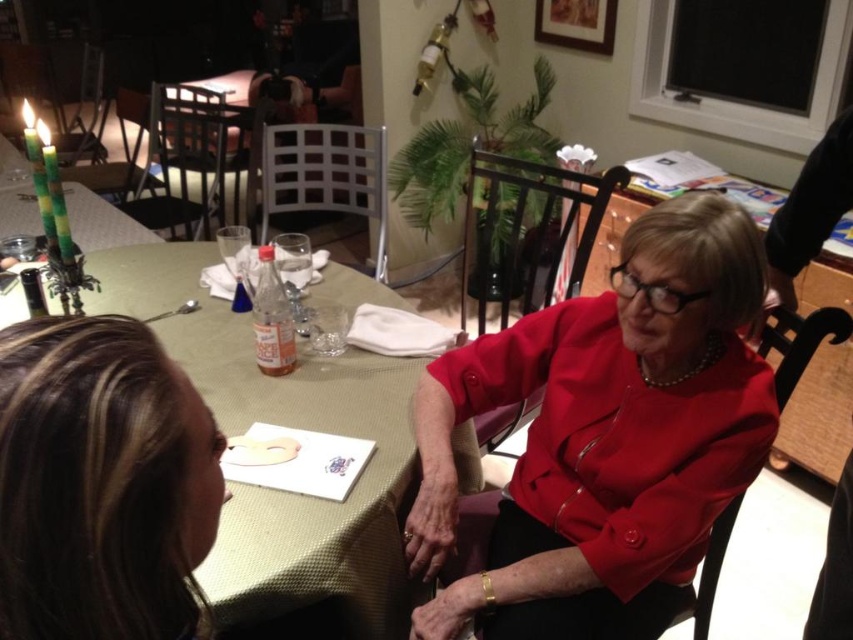
Who is positioned more to the left, brown hair at upper left or green fabric table at center?

green fabric table at center is more to the left.

Which is in front, point (125, 397) or point (183, 275)?

Point (125, 397) is more forward.

I want to click on brown hair at upper left, so click(x=96, y=483).

Who is positioned more to the right, matte red jacket at center or green fabric table at center?

matte red jacket at center is more to the right.

Which is more to the left, matte red jacket at center or green fabric table at center?

green fabric table at center

Does point (607, 337) come in front of point (138, 314)?

Yes, point (607, 337) is in front of point (138, 314).

Find the location of a particular element. This screenshot has width=853, height=640. matte red jacket at center is located at coordinates (605, 436).

Between matte red jacket at center and brown hair at upper left, which one has more height?

With more height is matte red jacket at center.

Does point (618, 420) come in front of point (149, 602)?

No, it is not.

Image resolution: width=853 pixels, height=640 pixels. What do you see at coordinates (605, 436) in the screenshot?
I see `matte red jacket at center` at bounding box center [605, 436].

Where is `matte red jacket at center`? The width and height of the screenshot is (853, 640). matte red jacket at center is located at coordinates (605, 436).